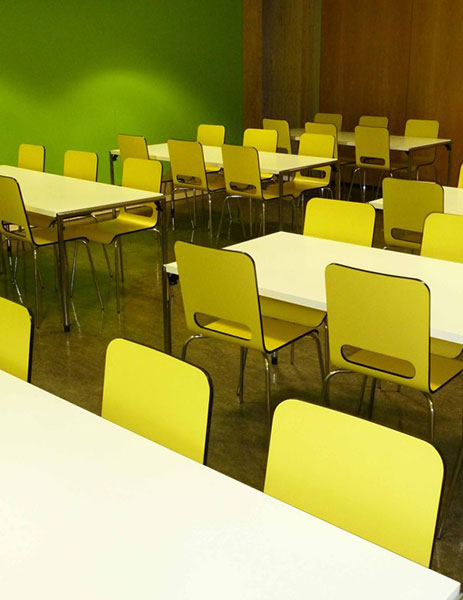
This screenshot has height=600, width=463. Identify the location of tabletops. (94, 197), (297, 163), (343, 137), (459, 199), (321, 257), (62, 483).